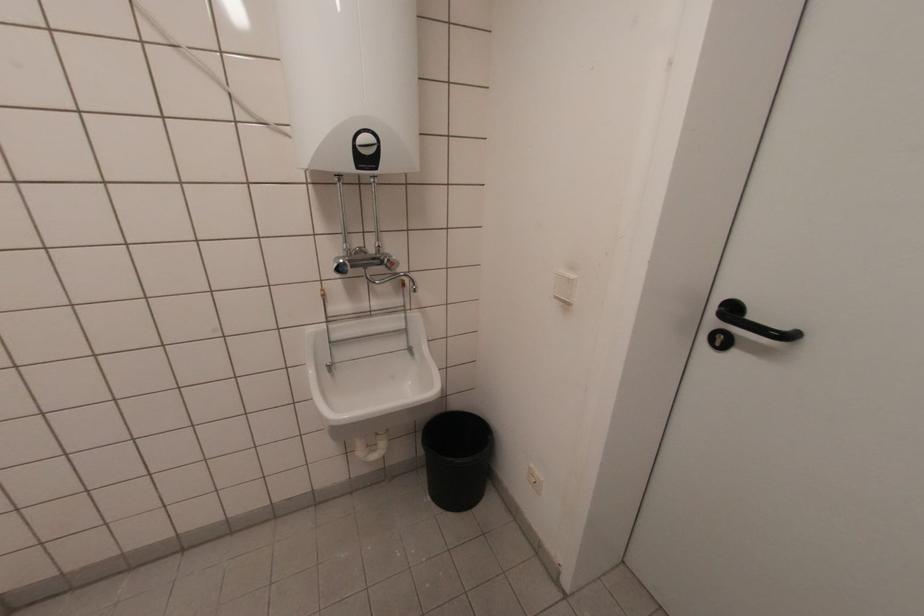
Describe the element at coordinates (745, 326) in the screenshot. I see `the black door handle` at that location.